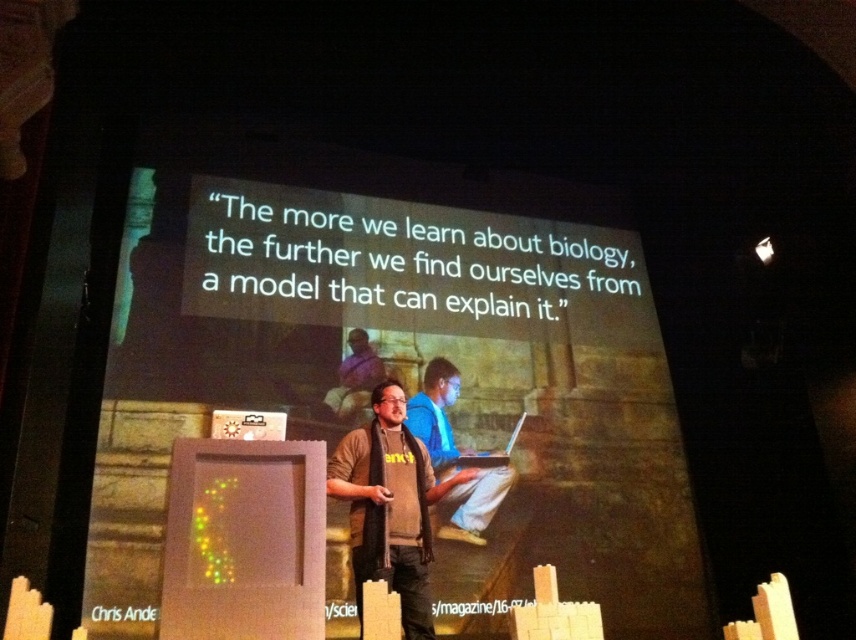
Question: From the image, what is the correct spatial relationship of brown textured sweater at center in relation to blue cotton shirt at center?

Choices:
 (A) below
 (B) above

Answer: (A)

Question: Is blue cotton shirt at center to the right of matte silver laptop at center from the viewer's perspective?

Choices:
 (A) no
 (B) yes

Answer: (A)

Question: Estimate the real-world distances between objects in this image. Which object is farther from the brown textured sweater at center?

Choices:
 (A) matte silver laptop at center
 (B) blue shirt at center

Answer: (B)

Question: Among these objects, which one is farthest from the camera?

Choices:
 (A) blue shirt at center
 (B) brown textured sweater at center
 (C) matte silver laptop at center
 (D) blue cotton shirt at center

Answer: (C)

Question: Does blue shirt at center have a smaller size compared to matte silver laptop at center?

Choices:
 (A) no
 (B) yes

Answer: (A)

Question: Based on their relative distances, which object is nearer to the blue shirt at center?

Choices:
 (A) blue cotton shirt at center
 (B) brown textured sweater at center
 (C) matte silver laptop at center

Answer: (A)